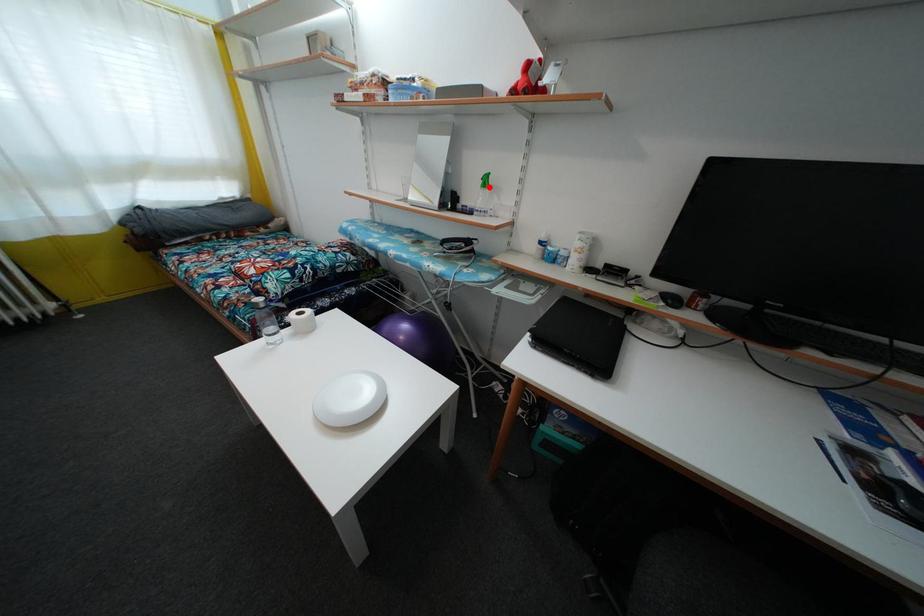
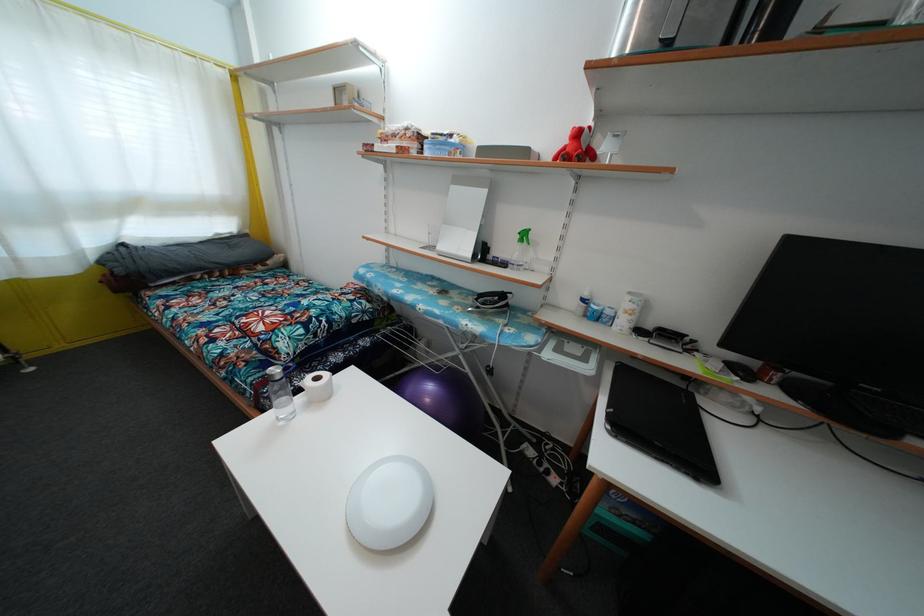
In the second image, find the point that corresponds to the highlighted location in the first image.

(528, 241)